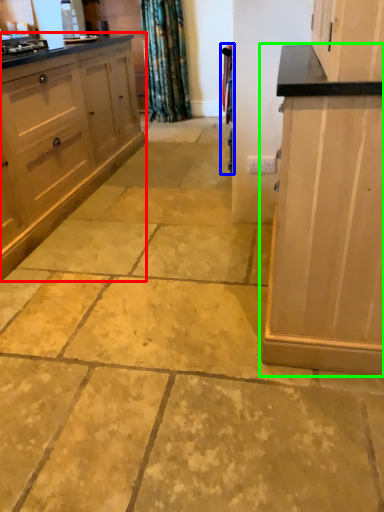
Question: Estimate the real-world distances between objects in this image. Which object is farther from cabinetry (highlighted by a red box), curtain (highlighted by a blue box) or cabinetry (highlighted by a green box)?

Choices:
 (A) curtain
 (B) cabinetry

Answer: (B)